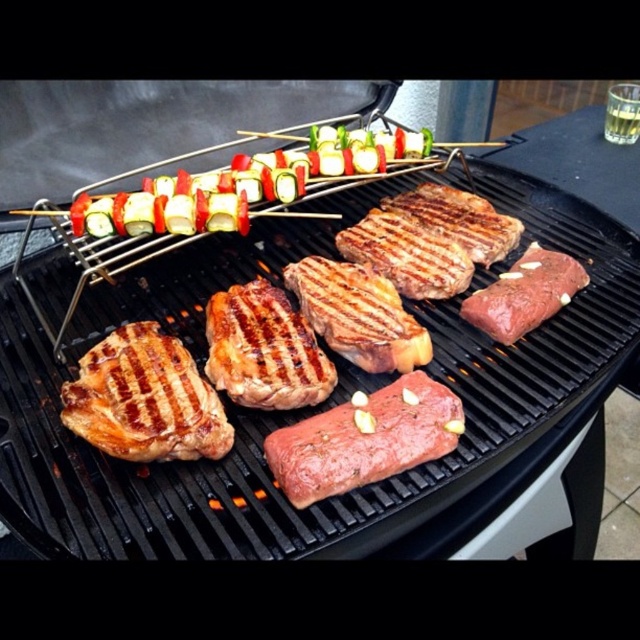
Question: Which point appears farthest from the camera in this image?

Choices:
 (A) (548, 300)
 (B) (250, 388)
 (C) (61, 417)

Answer: (A)

Question: Where is grilled meat at center located in relation to raw pink steak at center in the image?

Choices:
 (A) right
 (B) left

Answer: (A)

Question: Is raw pink steak at center above raw red steak at center?

Choices:
 (A) yes
 (B) no

Answer: (B)

Question: Which is nearer to the raw red steak at center?

Choices:
 (A) multicolored vegetable skewers at center
 (B) grilled brown steak at center
 (C) grilled meat at center
 (D) grilled brown steak at center-left

Answer: (C)

Question: Is grilled brown steak at center-left thinner than raw red steak at center?

Choices:
 (A) yes
 (B) no

Answer: (B)

Question: Which object is positioned closest to the grilled meat at center?

Choices:
 (A) grilled brown steak at center
 (B) raw pink steak at center

Answer: (A)